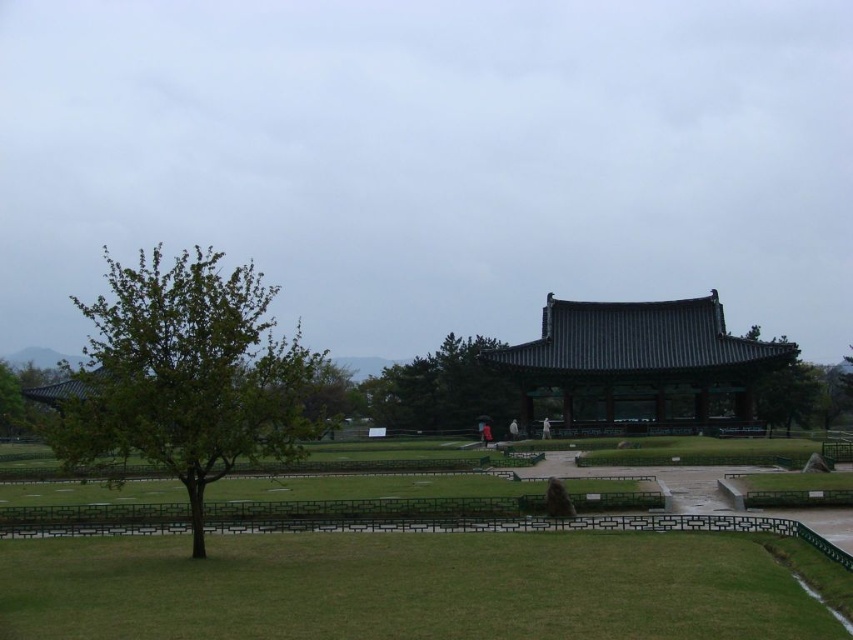
Question: Which object is positioned farthest from the green grass at center?

Choices:
 (A) green leafy tree at left
 (B) green leafy tree at center
 (C) dark gray tiled roof at center

Answer: (B)

Question: Is green grass at center bigger than green leafy tree at left?

Choices:
 (A) no
 (B) yes

Answer: (A)

Question: Which point appears farthest from the camera in this image?

Choices:
 (A) (465, 392)
 (B) (158, 355)
 (C) (86, 486)
 (D) (526, 346)

Answer: (A)

Question: In this image, where is green grass at center located relative to green leafy tree at left?

Choices:
 (A) below
 (B) above

Answer: (A)

Question: Which point is closer to the camera?

Choices:
 (A) green grass at center
 (B) green leafy tree at center

Answer: (A)

Question: Is green leafy tree at left above green leafy tree at center?

Choices:
 (A) yes
 (B) no

Answer: (A)